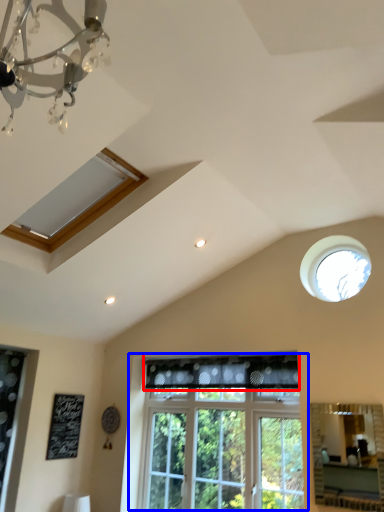
Question: Which object appears farthest to the camera in this image, curtain (highlighted by a red box) or window (highlighted by a blue box)?

Choices:
 (A) curtain
 (B) window

Answer: (A)